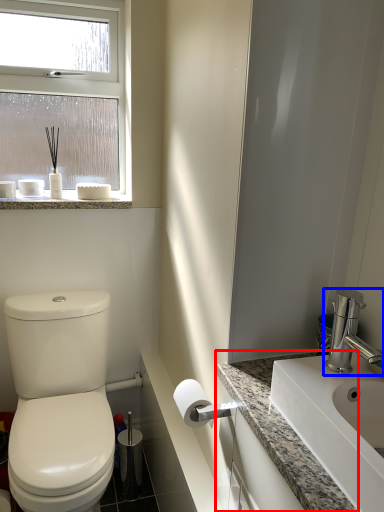
Question: Which point is further to the camera, counter top (highlighted by a red box) or tap (highlighted by a blue box)?

Choices:
 (A) counter top
 (B) tap

Answer: (B)